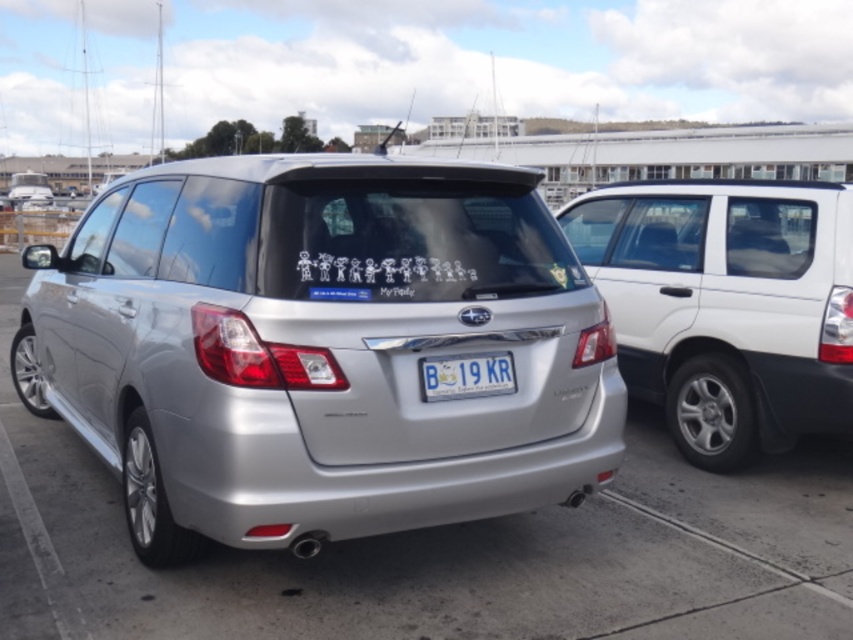
Which is below, satin silver car at center or white plastic license plate at center?

white plastic license plate at center is below.

Where is `satin silver car at center`? The width and height of the screenshot is (853, 640). satin silver car at center is located at coordinates (318, 348).

Who is more distant from viewer, (276, 292) or (431, 392)?

Positioned behind is point (431, 392).

Find the location of `satin silver car at center`. satin silver car at center is located at coordinates (318, 348).

Which is above, white matte minivan at right or white plastic license plate at center?

white matte minivan at right is above.

Which is behind, point (753, 348) or point (485, 388)?

Positioned behind is point (753, 348).

Where is `white matte minivan at right`? Image resolution: width=853 pixels, height=640 pixels. white matte minivan at right is located at coordinates point(726,305).

Can you confirm if satin silver car at center is positioned to the right of white matte minivan at right?

Incorrect, satin silver car at center is not on the right side of white matte minivan at right.

In the scene shown: Who is positioned more to the right, satin silver car at center or white matte minivan at right?

From the viewer's perspective, white matte minivan at right appears more on the right side.

Between point (22, 346) and point (734, 387), which one is positioned behind?

Point (22, 346)

Find the location of `satin silver car at center`. satin silver car at center is located at coordinates (318, 348).